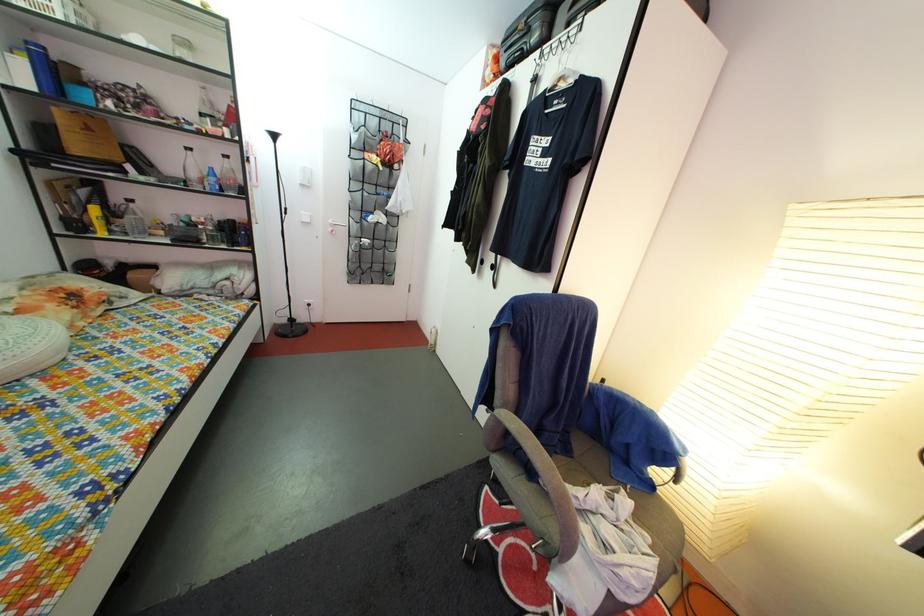
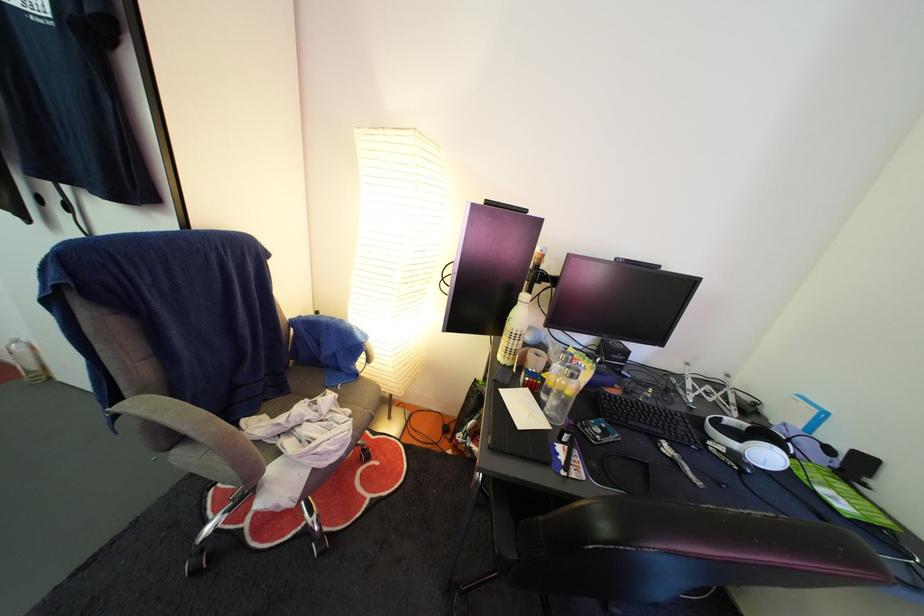
The point at [514,414] is marked in the first image. Where is the corresponding point in the second image?

(152, 400)